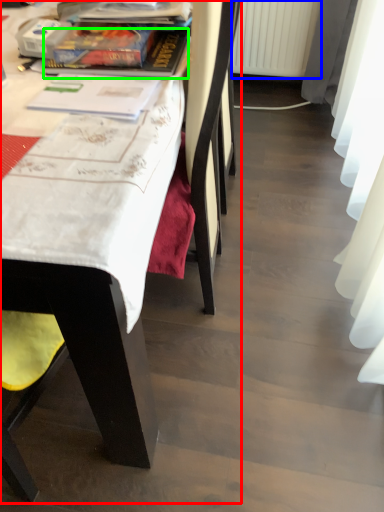
Question: Based on their relative distances, which object is nearer to chair (highlighted by a red box)? Choose from radiator (highlighted by a blue box) and book (highlighted by a green box).

Choices:
 (A) radiator
 (B) book

Answer: (B)